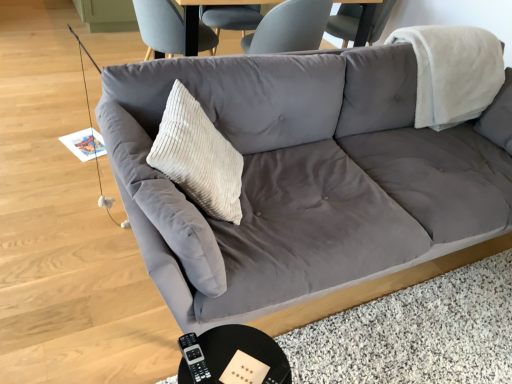
You are a GUI agent. You are given a task and a screenshot of the screen. Output one action in this format:
    pyautogui.click(x=<x>, y=<y>)
    Task: Click on the black glossy round table at lower center
    
    Given the screenshot: What is the action you would take?
    pyautogui.click(x=232, y=357)

Find the location of a particular element. Image resolution: width=512 pixels, height=384 pixels. studio couch lying above the black glossy round table at lower center (from the image's perspective) is located at coordinates (304, 177).

Which is closer, (x=495, y=136) or (x=287, y=369)?

The point (x=287, y=369) is in front.

Does suede gray couch at center have a lesser height compared to black glossy round table at lower center?

No.

From a real-world perspective, does black plastic remote at lower center sit lower than black glossy round table at lower center?

No, from a real-world perspective, black plastic remote at lower center is not below black glossy round table at lower center.

Measure the distance from black plastic remote at lower center to black glossy round table at lower center.

black plastic remote at lower center and black glossy round table at lower center are 2.74 inches apart from each other.

Is black glossy round table at lower center completely or partially inside black plastic remote at lower center?

No, black glossy round table at lower center is not a part of black plastic remote at lower center.

Does black plastic remote at lower center turn towards black glossy round table at lower center?

No, black plastic remote at lower center is not facing towards black glossy round table at lower center.

Which of these two, suede gray couch at center or black plastic remote at lower center, stands shorter?

black plastic remote at lower center is shorter.

Between suede gray couch at center and black plastic remote at lower center, which one appears on the left side from the viewer's perspective?

black plastic remote at lower center.

Image resolution: width=512 pixels, height=384 pixels. In order to click on studio couch lying on the right of black plastic remote at lower center in this screenshot , I will do `click(304, 177)`.

From the picture: Is suede gray couch at center in front of or behind black plastic remote at lower center in the image?

Visually, suede gray couch at center is located in front of black plastic remote at lower center.

Is beige corduroy pillow at center far from suede gray couch at center?

No, beige corduroy pillow at center is in close proximity to suede gray couch at center.

In the image, there is a suede gray couch at center. Where is `throw pillow above it (from the image's perspective)`? throw pillow above it (from the image's perspective) is located at coordinates (198, 157).

Is beige corduroy pillow at center at the right side of suede gray couch at center?

No, beige corduroy pillow at center is not to the right of suede gray couch at center.

Considering the positions of points (182, 169) and (360, 54), is point (182, 169) closer to camera compared to point (360, 54)?

Yes.

Find the location of a particular element. studio couch above the black glossy round table at lower center (from the image's perspective) is located at coordinates (304, 177).

From the image's perspective, is black glossy round table at lower center above or below suede gray couch at center?

Based on their image positions, black glossy round table at lower center is located beneath suede gray couch at center.

Is black glossy round table at lower center surrounding suede gray couch at center?

No, suede gray couch at center is not a part of black glossy round table at lower center.

Would you say black plastic remote at lower center is to the left or to the right of beige corduroy pillow at center in the picture?

black plastic remote at lower center is positioned on beige corduroy pillow at center's right side.

Could you tell me if black plastic remote at lower center is facing beige corduroy pillow at center?

No, black plastic remote at lower center does not turn towards beige corduroy pillow at center.

Is black plastic remote at lower center next to beige corduroy pillow at center?

No.

In the scene shown: Which is farther, (x=198, y=349) or (x=187, y=170)?

The point (x=187, y=170) is farther from the camera.

Is point (268, 366) behind point (207, 147)?

No, it is in front of (207, 147).

You are a GUI agent. You are given a task and a screenshot of the screen. Output one action in this format:
    pyautogui.click(x=<x>, y=<y>)
    Task: Click on the throw pillow that is above the black glossy round table at lower center (from a real-world perspective)
    This screenshot has height=384, width=512.
    Given the screenshot: What is the action you would take?
    pyautogui.click(x=198, y=157)

Is black glossy round table at lower center looking in the opposite direction of beige corduroy pillow at center?

No, black glossy round table at lower center is not facing away from beige corduroy pillow at center.

Can you confirm if black glossy round table at lower center is positioned to the right of beige corduroy pillow at center?

Correct, you'll find black glossy round table at lower center to the right of beige corduroy pillow at center.

Identify the location of studio couch that is above the black glossy round table at lower center (from the image's perspective). (304, 177).

Locate an element on the screen. round table below the black plastic remote at lower center (from a real-world perspective) is located at coordinates (232, 357).

Which object lies further to the anchor point beige corduroy pillow at center, suede gray couch at center or black plastic remote at lower center?

black plastic remote at lower center lies further to beige corduroy pillow at center than the other object.

When comparing their distances from black plastic remote at lower center, does beige corduroy pillow at center or black glossy round table at lower center seem further?

beige corduroy pillow at center.

Estimate the real-world distances between objects in this image. Which object is closer to black glossy round table at lower center, black plastic remote at lower center or beige corduroy pillow at center?

Based on the image, black plastic remote at lower center appears to be nearer to black glossy round table at lower center.

When comparing their distances from suede gray couch at center, does black plastic remote at lower center or black glossy round table at lower center seem further?

Among the two, black plastic remote at lower center is located further to suede gray couch at center.

Considering their positions, is suede gray couch at center positioned closer to black plastic remote at lower center than black glossy round table at lower center?

The object closer to black plastic remote at lower center is black glossy round table at lower center.

From the picture: From the image, which object appears to be nearer to suede gray couch at center, black glossy round table at lower center or black plastic remote at lower center?

black glossy round table at lower center is positioned closer to the anchor suede gray couch at center.

Considering their positions, is suede gray couch at center positioned closer to black glossy round table at lower center than black plastic remote at lower center?

The object closer to black glossy round table at lower center is black plastic remote at lower center.

Considering their positions, is suede gray couch at center positioned closer to black glossy round table at lower center than beige corduroy pillow at center?

beige corduroy pillow at center is closer to black glossy round table at lower center.

I want to click on remote between suede gray couch at center and black glossy round table at lower center vertically, so click(195, 359).

The width and height of the screenshot is (512, 384). What are the coordinates of `remote that lies between beige corduroy pillow at center and black glossy round table at lower center from top to bottom` in the screenshot? It's located at (195, 359).

Identify the location of remote between beige corduroy pillow at center and suede gray couch at center in the horizontal direction. (195, 359).

Find the location of `studio couch that lies between beige corduroy pillow at center and black glossy round table at lower center from top to bottom`. studio couch that lies between beige corduroy pillow at center and black glossy round table at lower center from top to bottom is located at coordinates [304, 177].